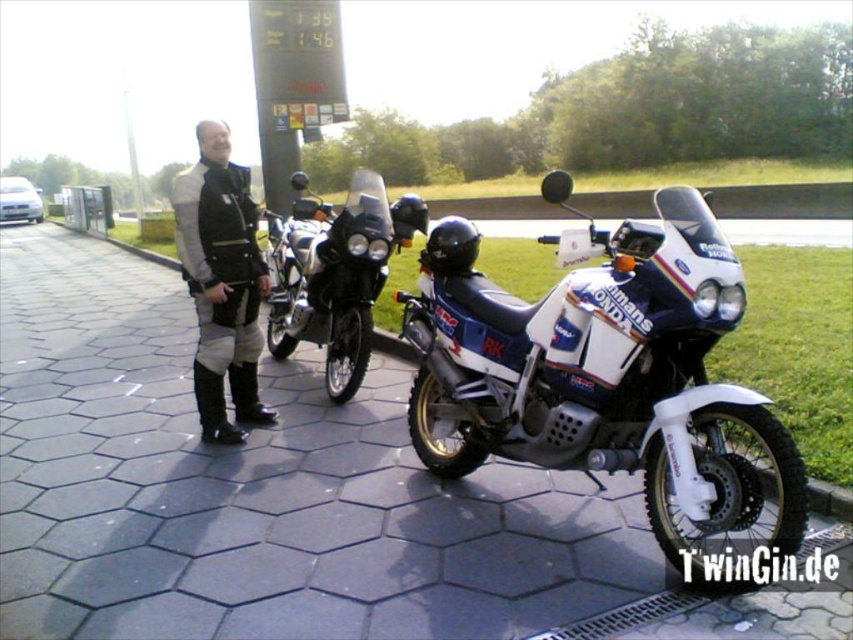
Question: Based on their relative distances, which object is farther from the black leather jacket at center?

Choices:
 (A) dark gray hexagonal tiles at center
 (B) white matte motorcycle at center
 (C) matte black motorcycle at center

Answer: (B)

Question: Considering the real-world distances, which object is farthest from the black leather jacket at center?

Choices:
 (A) matte black motorcycle at center
 (B) dark gray hexagonal tiles at center

Answer: (B)

Question: Is matte black motorcycle at center in front of black leather jacket at center?

Choices:
 (A) yes
 (B) no

Answer: (B)

Question: Can you confirm if white matte motorcycle at center is smaller than black leather jacket at center?

Choices:
 (A) yes
 (B) no

Answer: (B)

Question: Which object is the farthest from the dark gray hexagonal tiles at center?

Choices:
 (A) matte black motorcycle at center
 (B) black leather jacket at center
 (C) white matte motorcycle at center

Answer: (A)

Question: Is matte black motorcycle at center above black leather jacket at center?

Choices:
 (A) no
 (B) yes

Answer: (B)